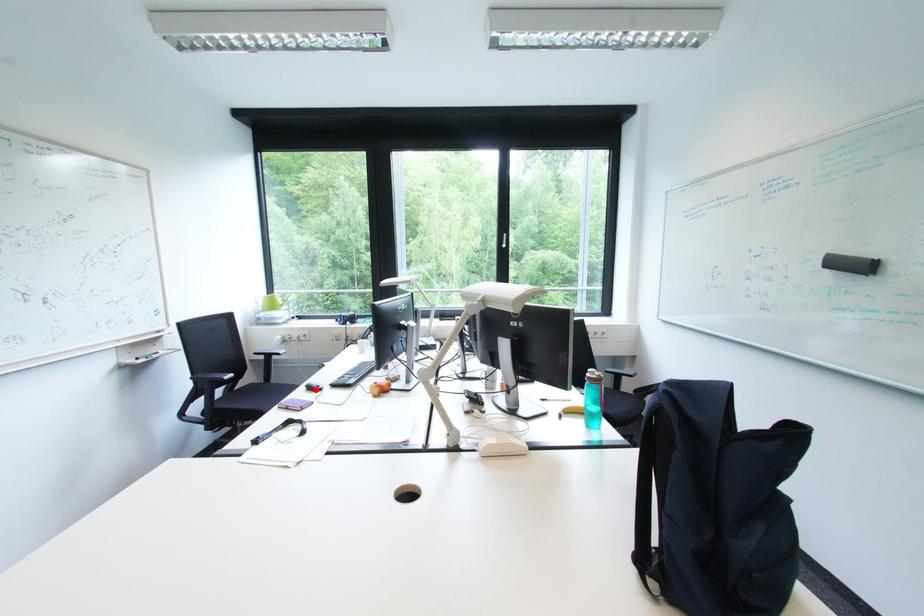
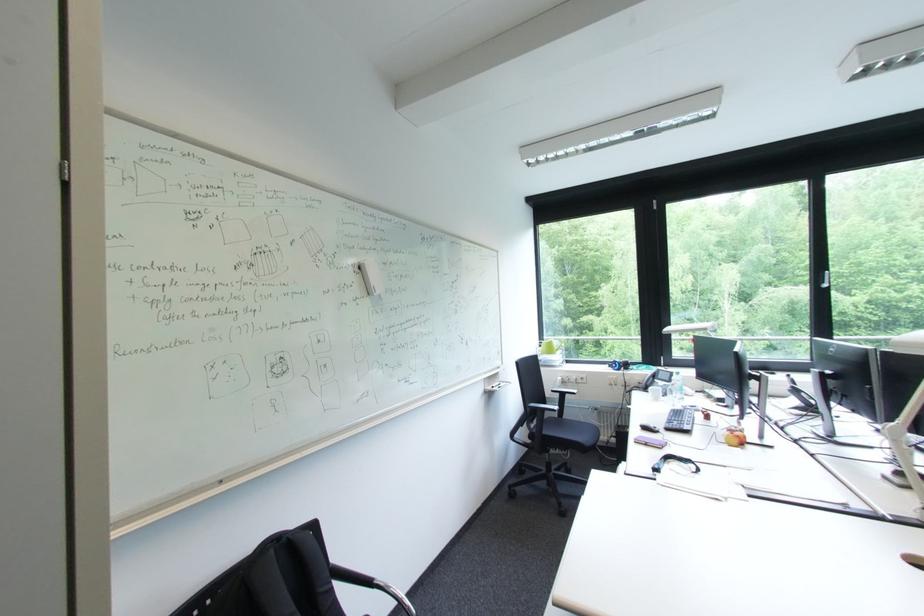
Question: I am providing you with two images of the same scene from different viewpoints. Given a red point in image1, look at the same physical point in image2. Is it:

Choices:
 (A) Closer to the viewpoint
 (B) Farther from the viewpoint

Answer: (A)